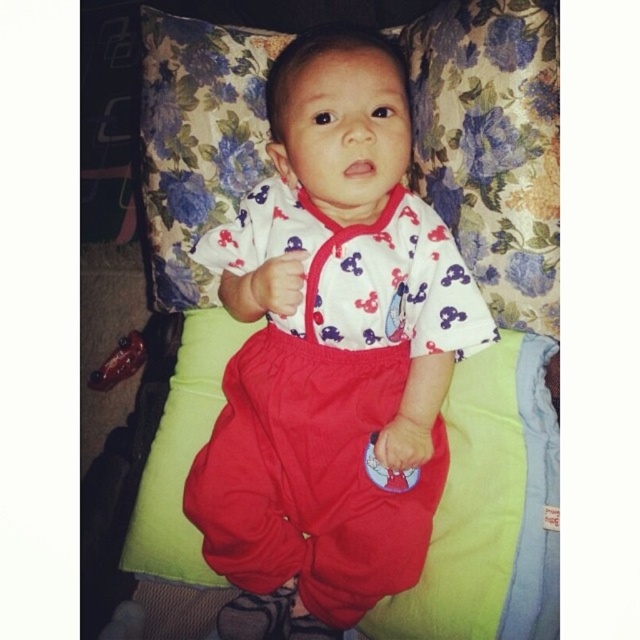
Question: Which of the following is the closest to the observer?

Choices:
 (A) (435, 433)
 (B) (196, 202)

Answer: (A)

Question: Which object appears farthest from the camera in this image?

Choices:
 (A) matte cotton baby at center
 (B) floral fabric pillow at upper center

Answer: (B)

Question: Does matte cotton baby at center appear under floral fabric pillow at upper center?

Choices:
 (A) no
 (B) yes

Answer: (B)

Question: Among these points, which one is farthest from the camera?

Choices:
 (A) (301, 468)
 (B) (552, 64)

Answer: (A)

Question: Can you confirm if matte cotton baby at center is positioned to the right of floral fabric pillow at upper center?

Choices:
 (A) no
 (B) yes

Answer: (A)

Question: Is matte cotton baby at center above floral fabric pillow at upper center?

Choices:
 (A) no
 (B) yes

Answer: (A)